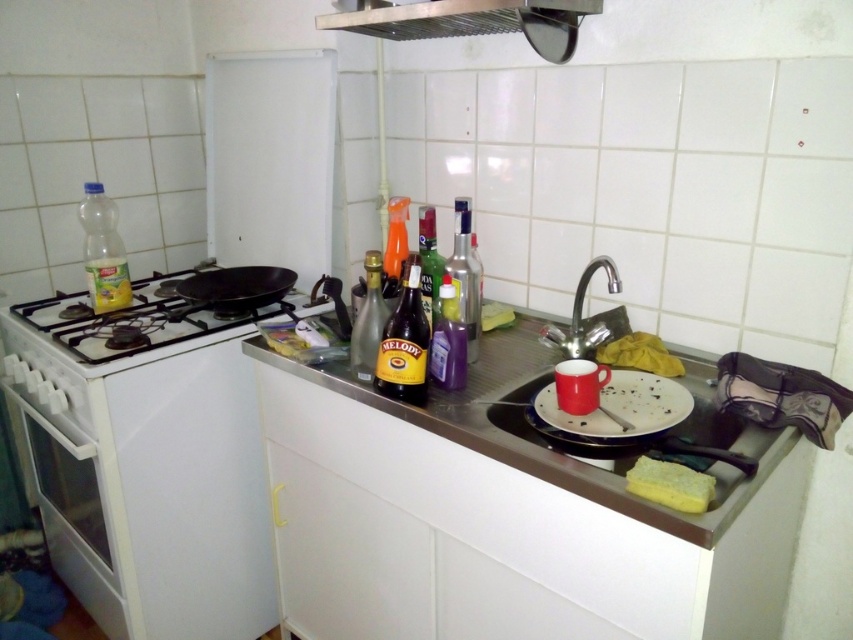
You are trying to fit a new appliance into the kitchen. The white glossy oven at left and the black matte frying pan at upper left are currently occupying space. Which object takes up more horizontal space?

The white glossy oven at left is wider than the black matte frying pan at upper left because its width surpasses the frying pan.

You are organizing the kitchen and need to place the translucent orange spray bottle at center on the counter next to the black matte gas stove at left. Can the spray bottle fit next to the stove if the counter space is only 1.2 meters wide?

The black matte gas stove at left is wider than the translucent orange spray bottle at center. Since the counter space is 1.2 meters wide, it depends on the combined width of both items. However, the description only states the stove is larger in width than the spray bottle but does not provide exact measurements. Without knowing the exact widths, it is impossible to determine if they will fit together on the 1.2 meter counter space.

You are a kitchen assistant who needs to place a 12 inch long spatula between the white glossy oven at left and the black matte frying pan at upper left. Can you fit it there?

The distance between the white glossy oven at left and the black matte frying pan at upper left is 16.74 inches, so yes, the 12 inch long spatula can fit between them since it is shorter than the available space.